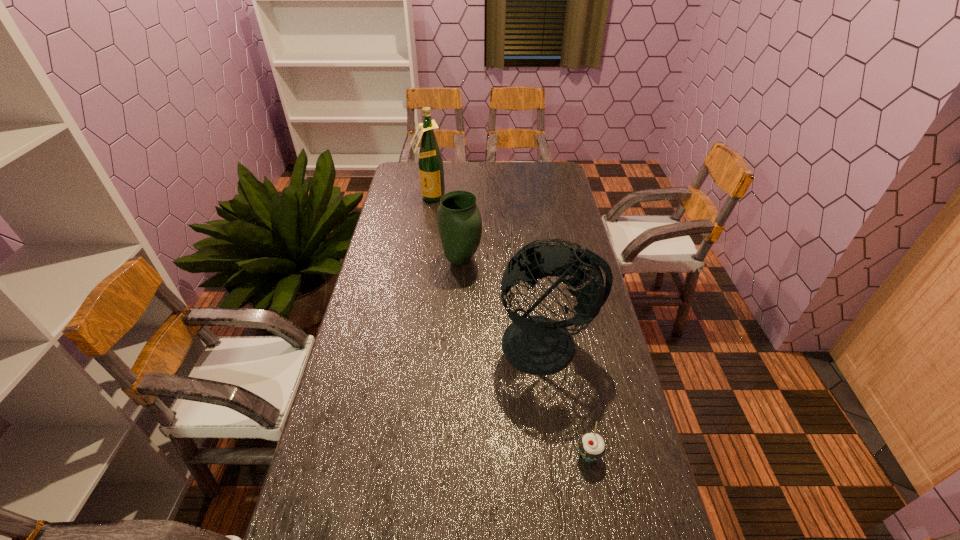
Identify the location of vacant space situated on the back of the cupcake. (574, 379).

You are a GUI agent. You are given a task and a screenshot of the screen. Output one action in this format:
    pyautogui.click(x=<x>, y=<y>)
    Task: Click on the object at the left edge
    The image size is (960, 540).
    Given the screenshot: What is the action you would take?
    pyautogui.click(x=430, y=162)

Locate an element on the screen. Image resolution: width=960 pixels, height=540 pixels. globe present at the right edge is located at coordinates click(536, 344).

Image resolution: width=960 pixels, height=540 pixels. I want to click on cupcake located in the right edge section of the desktop, so click(592, 447).

Image resolution: width=960 pixels, height=540 pixels. In the image, there is a desktop. Identify the location of vacant space at the far edge. (503, 181).

Locate an element on the screen. The width and height of the screenshot is (960, 540). blank area at the left edge is located at coordinates (368, 339).

Identify the location of free space at the right edge. (565, 217).

What are the coordinates of `free space at the far right corner of the desktop` in the screenshot? It's located at (540, 166).

Find the location of `free point between the globe and the liquor`. free point between the globe and the liquor is located at coordinates (489, 271).

This screenshot has width=960, height=540. Find the location of `object that ranks as the closest to the vase`. object that ranks as the closest to the vase is located at coordinates (536, 344).